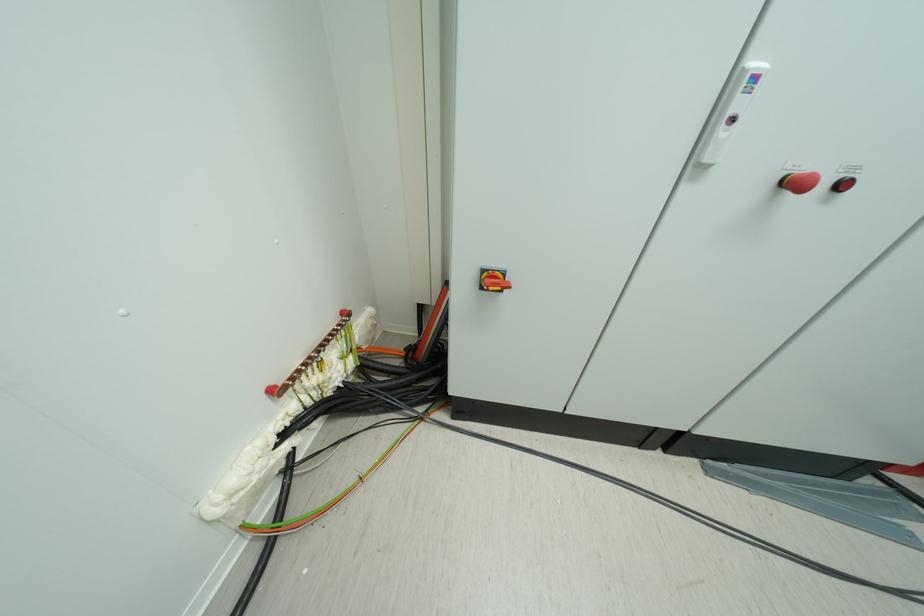
The width and height of the screenshot is (924, 616). Find the location of `white cabinet handle`. white cabinet handle is located at coordinates (734, 108).